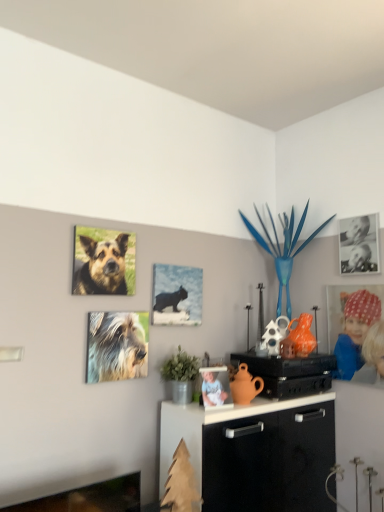
Question: From a real-world perspective, is matte black cat at center, which is the 2th picture frame in right-to-left order, under brown fur dog at upper left, positioned as the second dog in bottom-to-top order?

Choices:
 (A) no
 (B) yes

Answer: (B)

Question: Is matte black cat at center, which is counted as the 1th picture frame, starting from the bottom, aimed at brown fur dog at upper left, marked as the 1th dog in a top-to-bottom arrangement?

Choices:
 (A) no
 (B) yes

Answer: (A)

Question: Can you confirm if matte black cat at center, which appears as the second picture frame when viewed from the top, is taller than brown fur dog at upper left, marked as the 1th dog in a top-to-bottom arrangement?

Choices:
 (A) yes
 (B) no

Answer: (A)

Question: Is matte black cat at center, which appears as the second picture frame when viewed from the top, to the right of brown fur dog at upper left, marked as the 1th dog in a top-to-bottom arrangement, from the viewer's perspective?

Choices:
 (A) no
 (B) yes

Answer: (B)

Question: Would you say matte black cat at center, which is the 2th picture frame in right-to-left order, is outside brown fur dog at upper left, marked as the 1th dog in a top-to-bottom arrangement?

Choices:
 (A) yes
 (B) no

Answer: (A)

Question: Is matte black cat at center, which is the 2th picture frame in right-to-left order, at the left side of brown fur dog at upper left, marked as the 1th dog in a top-to-bottom arrangement?

Choices:
 (A) no
 (B) yes

Answer: (A)

Question: Is fuzzy fur dog at upper left, the 2th dog positioned from the top, at the left side of matte black speaker at center?

Choices:
 (A) yes
 (B) no

Answer: (A)

Question: Is fuzzy fur dog at upper left, the 2th dog positioned from the top, aimed at matte black speaker at center?

Choices:
 (A) yes
 (B) no

Answer: (B)

Question: Is fuzzy fur dog at upper left, the 2th dog positioned from the top, not near matte black speaker at center?

Choices:
 (A) yes
 (B) no

Answer: (B)

Question: Is fuzzy fur dog at upper left, the 2th dog positioned from the top, next to matte black speaker at center?

Choices:
 (A) no
 (B) yes

Answer: (A)

Question: Is fuzzy fur dog at upper left, the 2th dog positioned from the top, to the right of matte black speaker at center from the viewer's perspective?

Choices:
 (A) yes
 (B) no

Answer: (B)

Question: From the image's perspective, is fuzzy fur dog at upper left, the 1th dog positioned from the bottom, on matte black speaker at center?

Choices:
 (A) no
 (B) yes

Answer: (B)

Question: Would you consider white porcelain figurine at center, the second person in the back-to-front sequence, to be distant from black paper photo at upper right, which is the first picture frame from right to left?

Choices:
 (A) yes
 (B) no

Answer: (A)